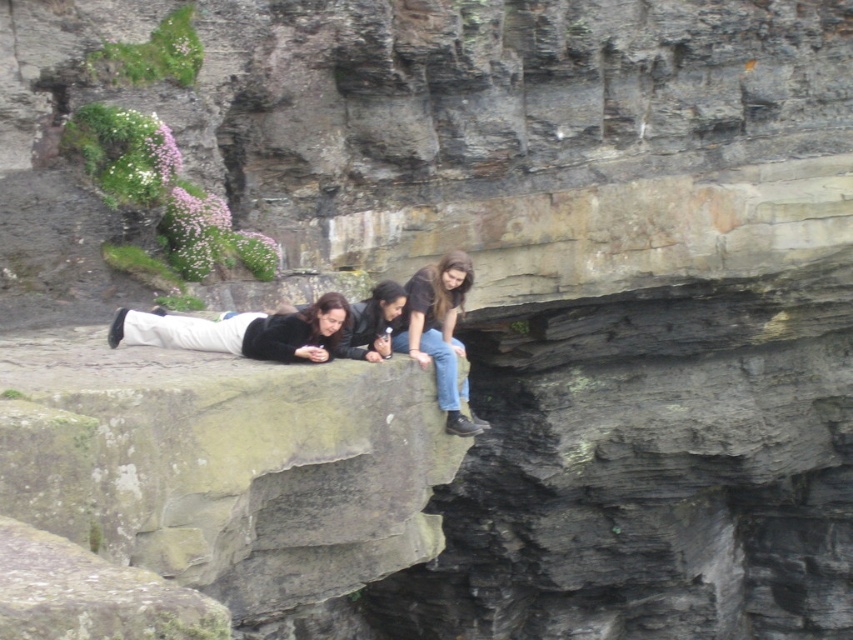
Who is taller, matte black jacket at center or black leather jacket at center?

With more height is black leather jacket at center.

Between matte black jacket at center and black leather jacket at center, which one is positioned higher?

black leather jacket at center is above.

Which is behind, point (350, 336) or point (370, 326)?

The point (370, 326) is more distant.

Locate an element on the screen. The height and width of the screenshot is (640, 853). matte black jacket at center is located at coordinates [277, 330].

Does jeans at center appear under black leather jacket at center?

Correct, jeans at center is located below black leather jacket at center.

Does point (396, 339) come in front of point (387, 285)?

No, it is not.

What do you see at coordinates (439, 332) in the screenshot? The height and width of the screenshot is (640, 853). I see `jeans at center` at bounding box center [439, 332].

Identify the location of jeans at center. The image size is (853, 640). (439, 332).

Which is more to the right, matte black jacket at center or matte black shirt at center?

matte black jacket at center is more to the right.

How distant is matte black jacket at center from matte black shirt at center?

The distance of matte black jacket at center from matte black shirt at center is 6.51 feet.

I want to click on matte black jacket at center, so click(277, 330).